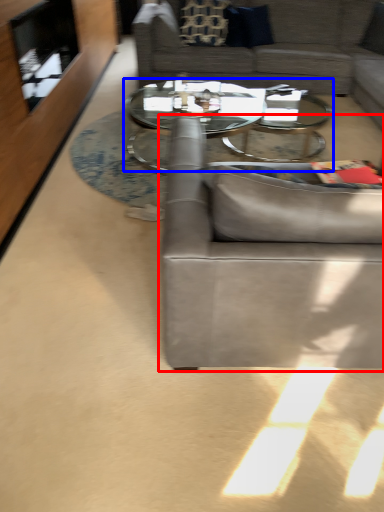
Question: Among these objects, which one is nearest to the camera, studio couch (highlighted by a red box) or coffee table (highlighted by a blue box)?

Choices:
 (A) studio couch
 (B) coffee table

Answer: (A)